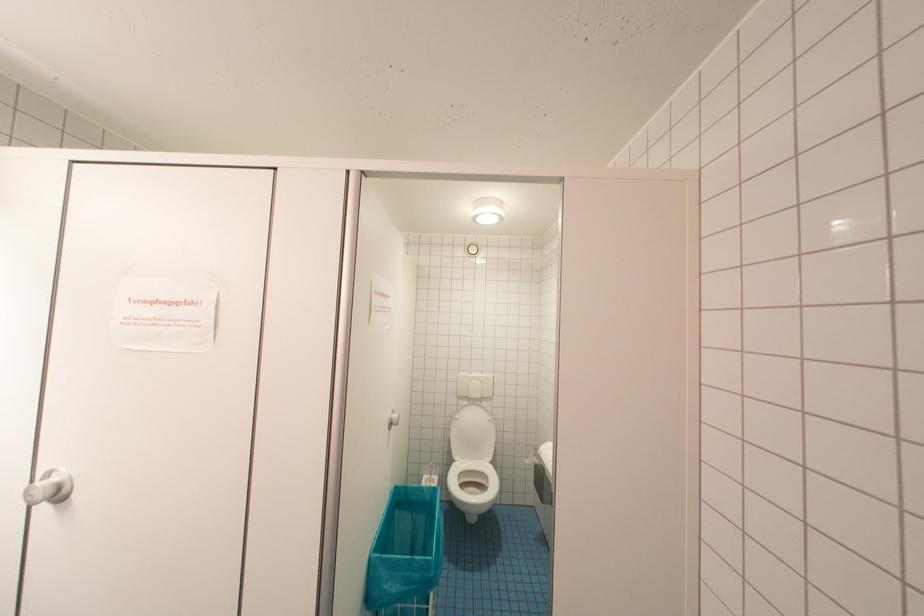
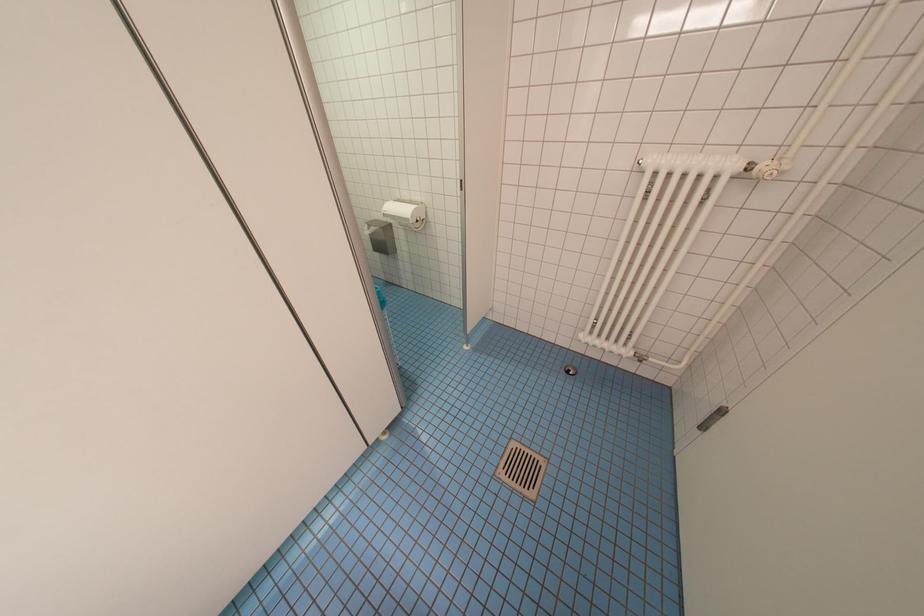
How did the camera likely rotate?

The camera's rotation is toward right-down.